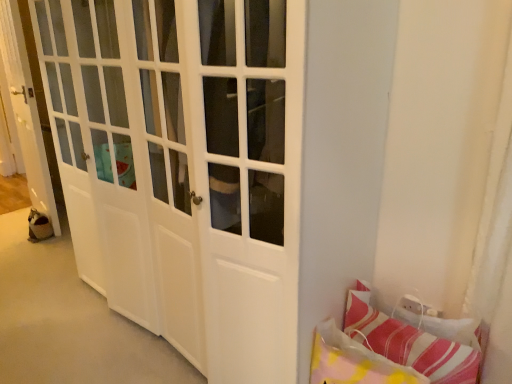
Question: Does white glossy door at left have a lesser width compared to striped fabric pillow at lower right, the 2th pillow in the left-to-right sequence?

Choices:
 (A) no
 (B) yes

Answer: (A)

Question: Does white glossy door at left have a greater width compared to striped fabric pillow at lower right, which appears as the 1th pillow when viewed from the right?

Choices:
 (A) yes
 (B) no

Answer: (A)

Question: Does white glossy door at left have a smaller size compared to striped fabric pillow at lower right, the 2th pillow in the left-to-right sequence?

Choices:
 (A) yes
 (B) no

Answer: (B)

Question: From the image's perspective, is white glossy door at left below striped fabric pillow at lower right, which appears as the 1th pillow when viewed from the right?

Choices:
 (A) yes
 (B) no

Answer: (B)

Question: Is white glossy door at left looking in the opposite direction of striped fabric pillow at lower right, the 2th pillow in the left-to-right sequence?

Choices:
 (A) no
 (B) yes

Answer: (A)

Question: Is white glossy door at left positioned before striped fabric pillow at lower right, the 2th pillow in the left-to-right sequence?

Choices:
 (A) no
 (B) yes

Answer: (A)

Question: Is striped fabric pillow at lower right, the 2th pillow in the left-to-right sequence, facing towards striped fabric pillow at lower right, which is the 1th pillow from left to right?

Choices:
 (A) yes
 (B) no

Answer: (A)

Question: Is striped fabric pillow at lower right, which appears as the 1th pillow when viewed from the right, next to striped fabric pillow at lower right, which ranks as the second pillow in right-to-left order?

Choices:
 (A) yes
 (B) no

Answer: (B)

Question: Can you confirm if striped fabric pillow at lower right, which appears as the 1th pillow when viewed from the right, is positioned to the right of striped fabric pillow at lower right, which ranks as the second pillow in right-to-left order?

Choices:
 (A) yes
 (B) no

Answer: (A)

Question: Does striped fabric pillow at lower right, which appears as the 1th pillow when viewed from the right, appear on the left side of striped fabric pillow at lower right, which is the 1th pillow from left to right?

Choices:
 (A) no
 (B) yes

Answer: (A)

Question: Is striped fabric pillow at lower right, the 2th pillow in the left-to-right sequence, positioned with its back to striped fabric pillow at lower right, which is the 1th pillow from left to right?

Choices:
 (A) yes
 (B) no

Answer: (A)

Question: Is the position of striped fabric pillow at lower right, the 2th pillow in the left-to-right sequence, less distant than that of striped fabric pillow at lower right, which ranks as the second pillow in right-to-left order?

Choices:
 (A) yes
 (B) no

Answer: (B)

Question: Is white glossy door at left bigger than striped fabric pillow at lower right, which ranks as the second pillow in right-to-left order?

Choices:
 (A) yes
 (B) no

Answer: (A)